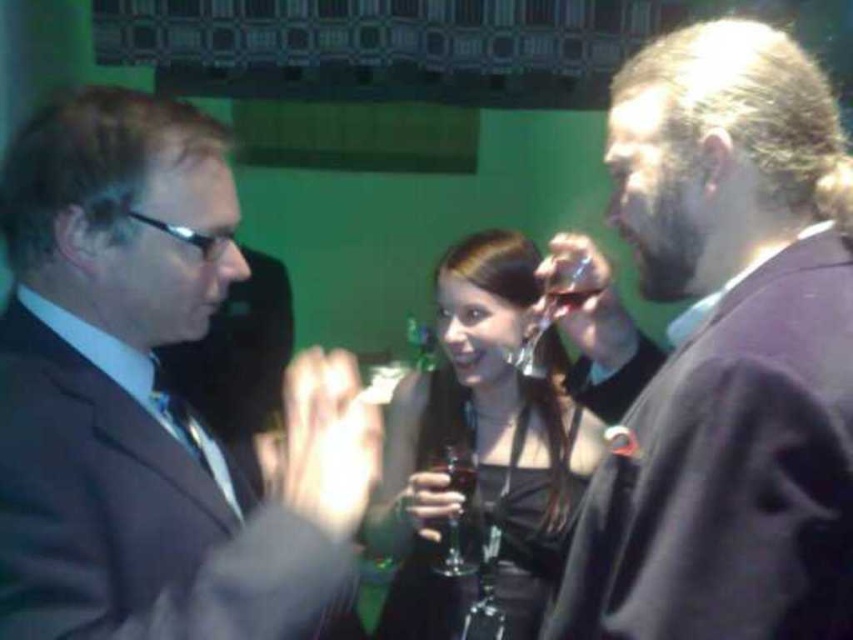
Looking at this image, you are at a party and want to grab a drink. You see the matte black suit at left and the clear glass at upper center. Which object is taller?

The matte black suit at left is taller than the clear glass at upper center.

You are a photographer at this event and need to capture a photo of both the matte black suit at left and the satin black dress at center. The camera you are using has a minimum focus distance of 50 centimeters. Will you be able to focus on both subjects at the same time?

The matte black suit at left and the satin black dress at center are 50.73 centimeters apart. Since the camera requires a minimum focus distance of 50 centimeters, the distance between them is sufficient, so yes, you can focus on both subjects simultaneously.

You are standing at the entrance of the room and want to approach the person wearing the matte black suit at left. According to the coordinates provided, in which direction should you move from your current position to reach them?

The matte black suit at left is located at coordinates point (151, 397). Since the x and y coordinates are both positive, you should move towards the right and forward to reach the person wearing the matte black suit at left.